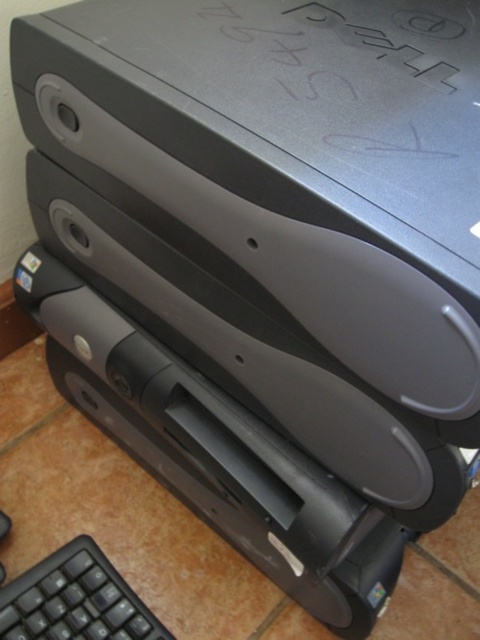
Question: Which object appears farthest from the camera in this image?

Choices:
 (A) black matte text at upper center
 (B) black matte keyboard at lower left

Answer: (B)

Question: Is black matte text at upper center wider than black matte keyboard at lower left?

Choices:
 (A) yes
 (B) no

Answer: (A)

Question: Does black matte text at upper center lie behind black matte keyboard at lower left?

Choices:
 (A) yes
 (B) no

Answer: (B)

Question: Does black matte text at upper center have a lesser width compared to black matte keyboard at lower left?

Choices:
 (A) no
 (B) yes

Answer: (A)

Question: Which point is farther from the camera taking this photo?

Choices:
 (A) 73,579
 (B) 354,124

Answer: (A)